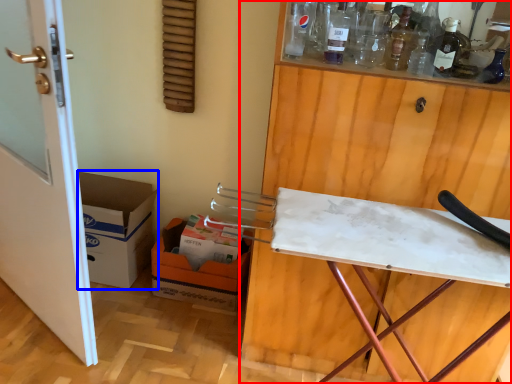
Question: Which object is closer to the camera taking this photo, cabinetry (highlighted by a red box) or cardboard box (highlighted by a blue box)?

Choices:
 (A) cabinetry
 (B) cardboard box

Answer: (A)